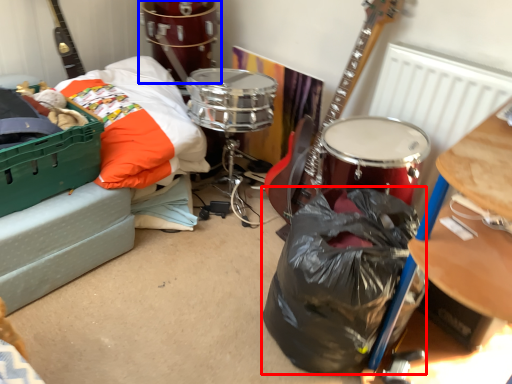
Question: Which point is closer to the camera, garbage (highlighted by a red box) or drum (highlighted by a blue box)?

Choices:
 (A) garbage
 (B) drum

Answer: (A)